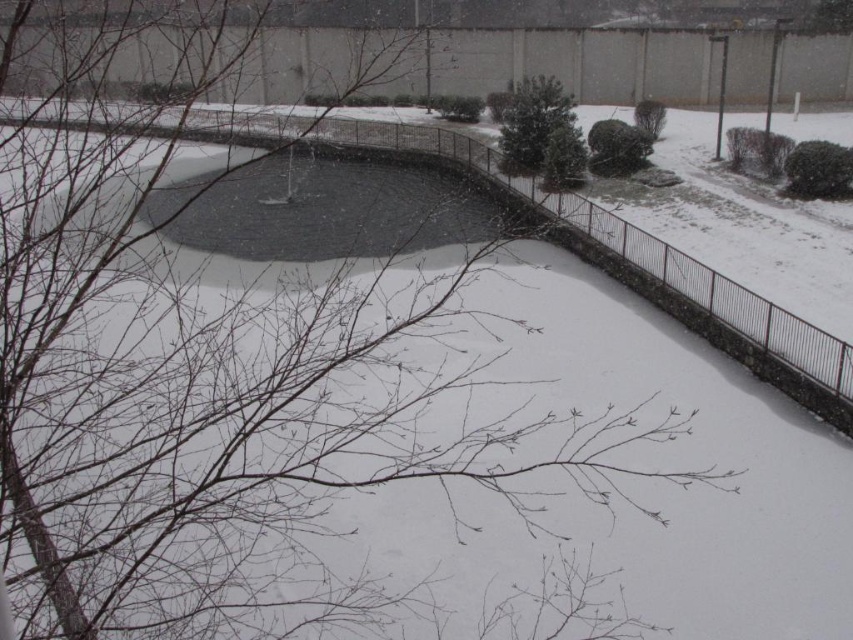
Question: Which of the following is the farthest from the observer?

Choices:
 (A) (630, 132)
 (B) (827, 196)

Answer: (A)

Question: Can you confirm if green matte tree at center is positioned below green matte bush at upper right?

Choices:
 (A) yes
 (B) no

Answer: (B)

Question: Among these points, which one is nearest to the camera?

Choices:
 (A) (808, 196)
 (B) (512, 157)
 (C) (660, 106)

Answer: (A)

Question: Which point is farther to the camera?

Choices:
 (A) green matte bush at upper center
 (B) green matte tree at center

Answer: (A)

Question: Does green matte tree at center appear under green matte bush at upper center?

Choices:
 (A) yes
 (B) no

Answer: (B)

Question: Can you confirm if green matte bush at upper center is positioned above green leafy bush at upper center?

Choices:
 (A) yes
 (B) no

Answer: (B)